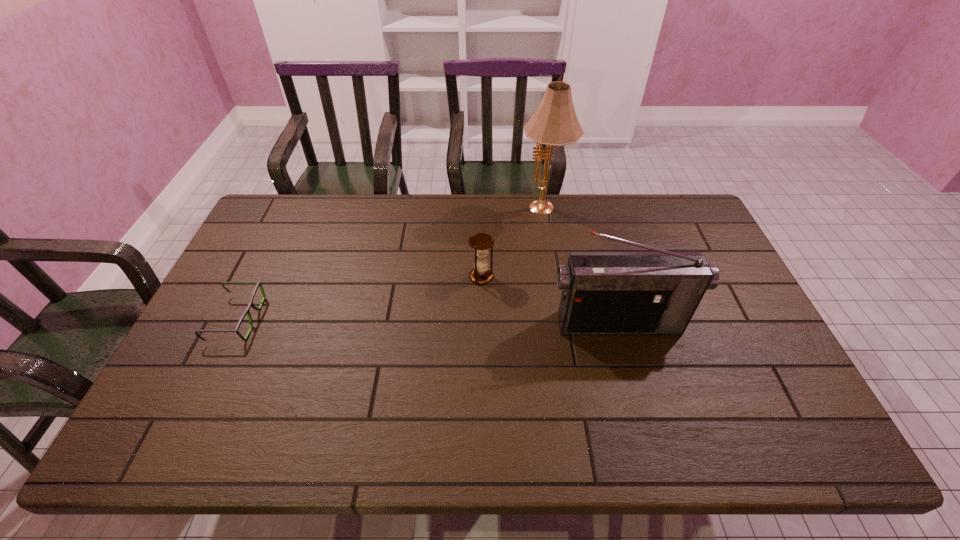
I want to click on empty space between the third shortest object and the leftmost object, so click(x=427, y=321).

I want to click on free space that is in between the farthest object and the shortest object, so (x=390, y=265).

Image resolution: width=960 pixels, height=540 pixels. What are the coordinates of `vacant region between the third nearest object and the second tallest object` in the screenshot? It's located at (550, 300).

Select which object is the closest to the shortest object. Please provide its 2D coordinates. Your answer should be formatted as a tuple, i.e. [(x, y)], where the tuple contains the x and y coordinates of a point satisfying the conditions above.

[(481, 242)]

Identify which object is the closest to the farthest object. Please provide its 2D coordinates. Your answer should be formatted as a tuple, i.e. [(x, y)], where the tuple contains the x and y coordinates of a point satisfying the conditions above.

[(481, 242)]

Identify the location of blank space that satisfies the following two spatial constraints: 1. on the back side of the farthest object; 2. on the left side of the third nearest object. Image resolution: width=960 pixels, height=540 pixels. (481, 210).